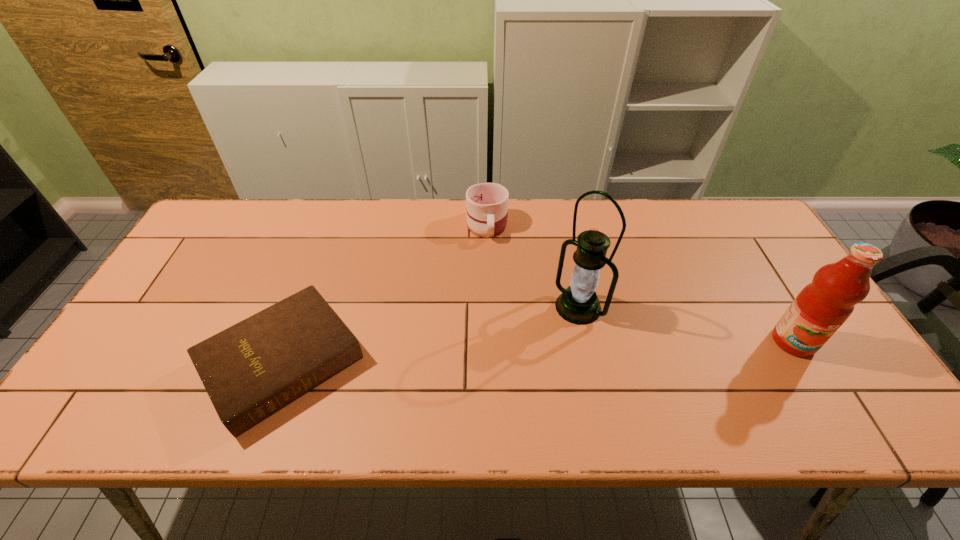
Identify the location of the shortest object. (251, 370).

Locate an element on the screen. The height and width of the screenshot is (540, 960). Bible is located at coordinates (251, 370).

Where is `the rightmost object`? This screenshot has width=960, height=540. the rightmost object is located at coordinates (822, 306).

You are a GUI agent. You are given a task and a screenshot of the screen. Output one action in this format:
    pyautogui.click(x=<x>, y=<y>)
    Task: Click on the fruit juice
    
    Given the screenshot: What is the action you would take?
    pyautogui.click(x=822, y=306)

What are the coordinates of `the third object from left to right` in the screenshot? It's located at (578, 304).

Identify the location of the tallest object. This screenshot has width=960, height=540. (578, 304).

Where is `the third tallest object`? This screenshot has width=960, height=540. the third tallest object is located at coordinates (486, 203).

Where is `the farthest object`? This screenshot has width=960, height=540. the farthest object is located at coordinates (486, 203).

The image size is (960, 540). I want to click on vacant space positioned 0.220m on the right of the shortest object, so click(455, 363).

The height and width of the screenshot is (540, 960). Identify the location of vacant space situated on the front label of the third shortest object. (819, 384).